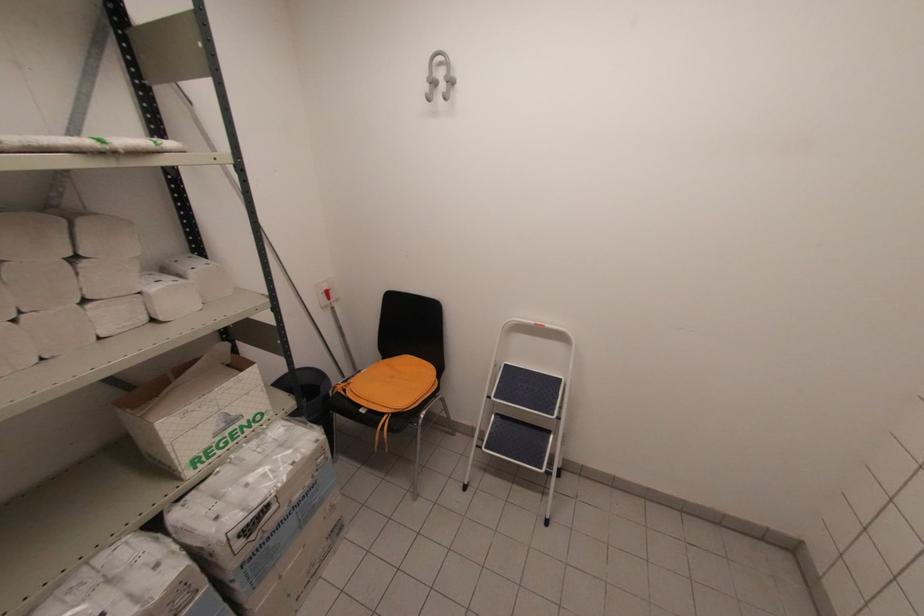
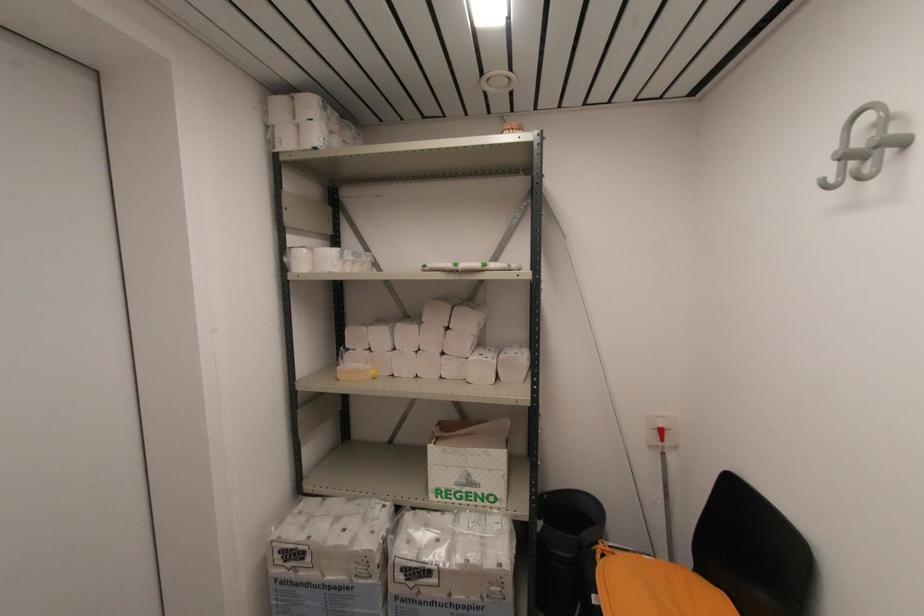
Locate, in the second image, the point that corresponds to pixel 431 84 in the first image.

(843, 160)